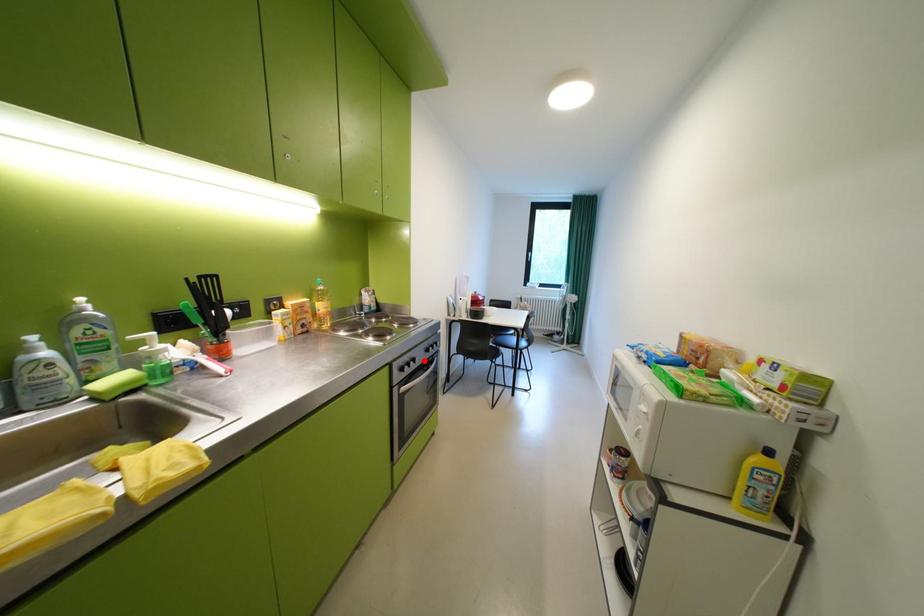
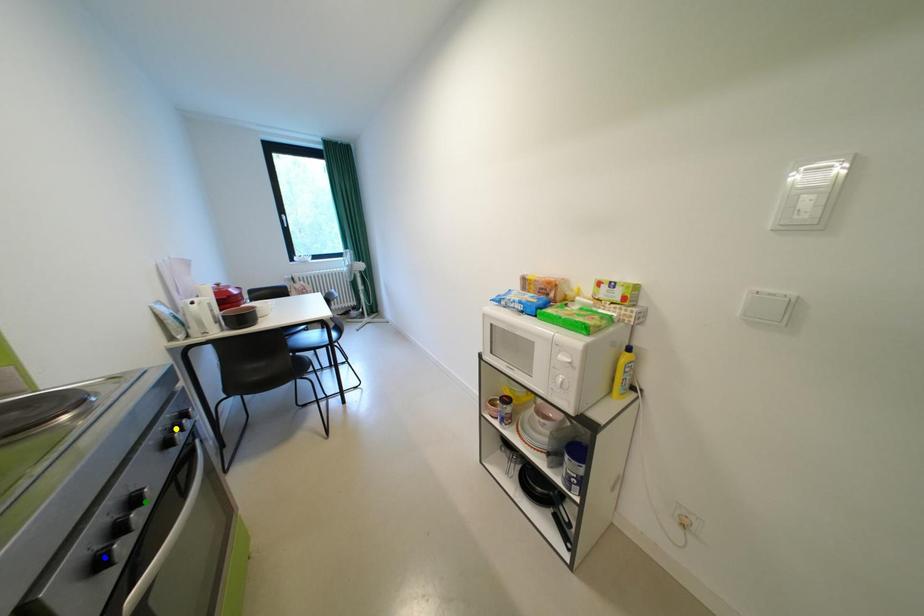
Question: I am providing you with two images of the same scene from different viewpoints. A red point is marked on the first image. You are given multiple points on the second image. Which point in image 2 represents the same 3d spot as the red point in image 1?

Choices:
 (A) blue point
 (B) green point
 (C) yellow point

Answer: (B)